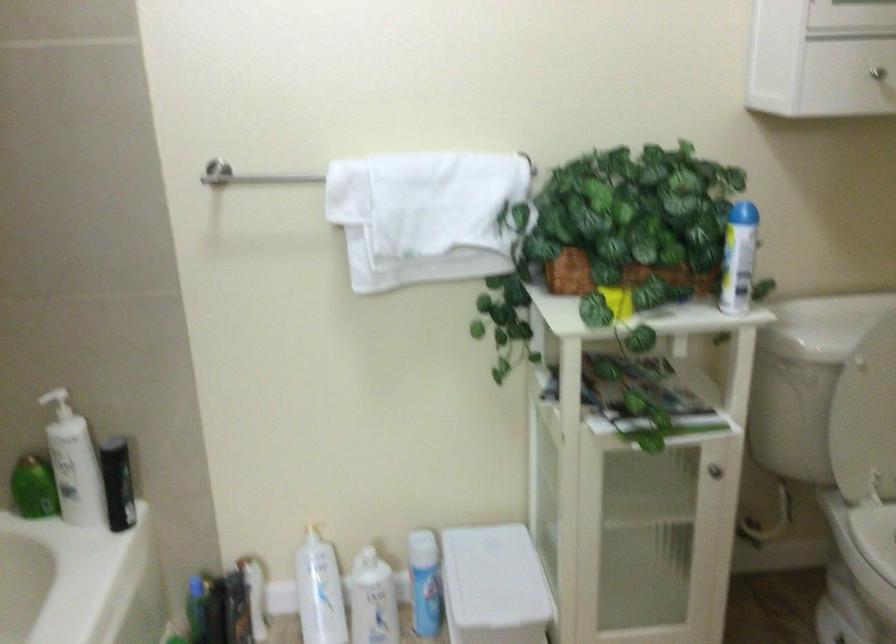
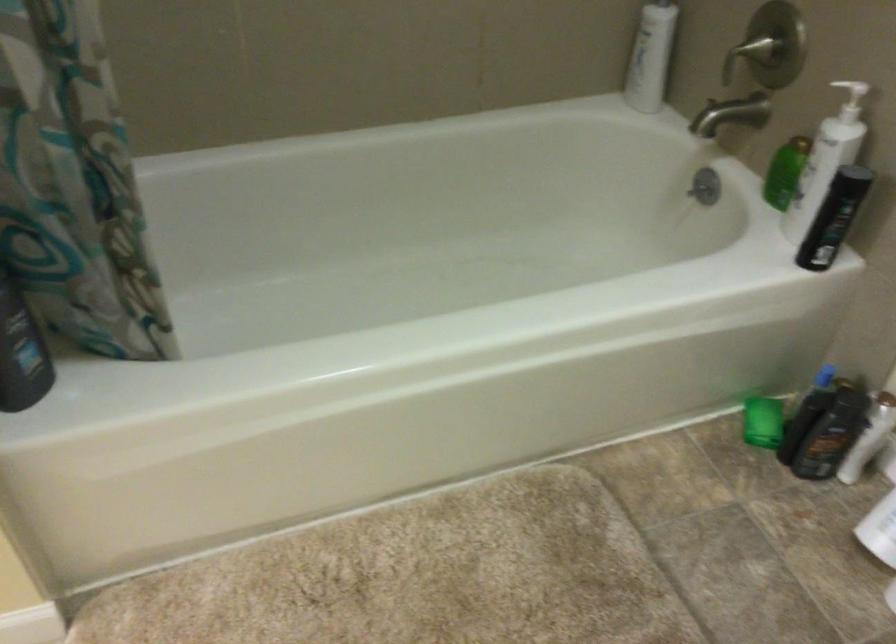
Based on the photo, how did the camera likely rotate?

The rotation direction of the camera is left-down.